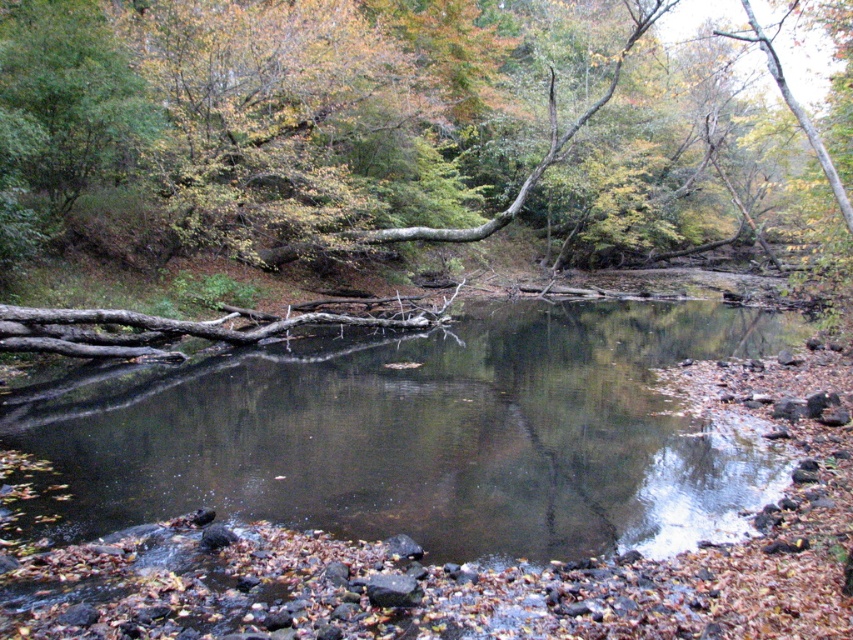
Question: Which of the following is the closest to the observer?

Choices:
 (A) smooth brown log at center
 (B) smooth dark water at center

Answer: (B)

Question: Observing the image, what is the correct spatial positioning of smooth brown log at center in reference to smooth dark water at center?

Choices:
 (A) right
 (B) left

Answer: (A)

Question: Does smooth brown log at center have a larger size compared to smooth dark water at center?

Choices:
 (A) no
 (B) yes

Answer: (B)

Question: Among these points, which one is nearest to the camera?

Choices:
 (A) (471, 408)
 (B) (55, 140)

Answer: (A)

Question: Can you confirm if smooth brown log at center is positioned above smooth dark water at center?

Choices:
 (A) no
 (B) yes

Answer: (B)